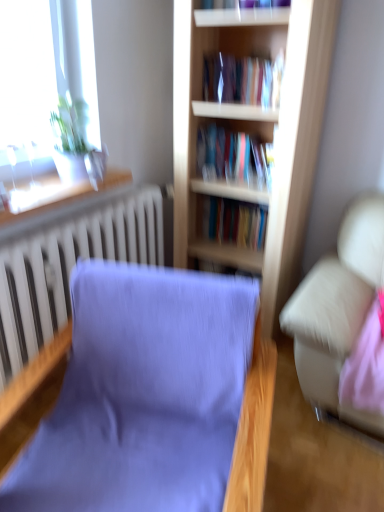
Question: From a real-world perspective, does light wood bookcase at center stand above white textured radiator at left?

Choices:
 (A) no
 (B) yes

Answer: (B)

Question: Can you confirm if light wood bookcase at center is bigger than white textured radiator at left?

Choices:
 (A) yes
 (B) no

Answer: (A)

Question: Is light wood bookcase at center closer to camera compared to white textured radiator at left?

Choices:
 (A) no
 (B) yes

Answer: (A)

Question: Is white textured radiator at left completely or partially inside light wood bookcase at center?

Choices:
 (A) yes
 (B) no

Answer: (B)

Question: From the image's perspective, does light wood bookcase at center appear lower than white textured radiator at left?

Choices:
 (A) yes
 (B) no

Answer: (B)

Question: Can you confirm if light wood bookcase at center is wider than white textured radiator at left?

Choices:
 (A) no
 (B) yes

Answer: (B)

Question: Does purple fabric chair at center have a greater width compared to wooden window sill at upper left?

Choices:
 (A) yes
 (B) no

Answer: (A)

Question: From the image's perspective, is purple fabric chair at center beneath wooden window sill at upper left?

Choices:
 (A) yes
 (B) no

Answer: (A)

Question: From a real-world perspective, is purple fabric chair at center located beneath wooden window sill at upper left?

Choices:
 (A) no
 (B) yes

Answer: (B)

Question: Considering the relative sizes of purple fabric chair at center and wooden window sill at upper left in the image provided, is purple fabric chair at center bigger than wooden window sill at upper left?

Choices:
 (A) yes
 (B) no

Answer: (A)

Question: Does purple fabric chair at center lie behind wooden window sill at upper left?

Choices:
 (A) no
 (B) yes

Answer: (A)

Question: Is purple fabric chair at center at the left side of wooden window sill at upper left?

Choices:
 (A) yes
 (B) no

Answer: (B)

Question: Is white textured radiator at left located outside wooden window sill at upper left?

Choices:
 (A) yes
 (B) no

Answer: (A)